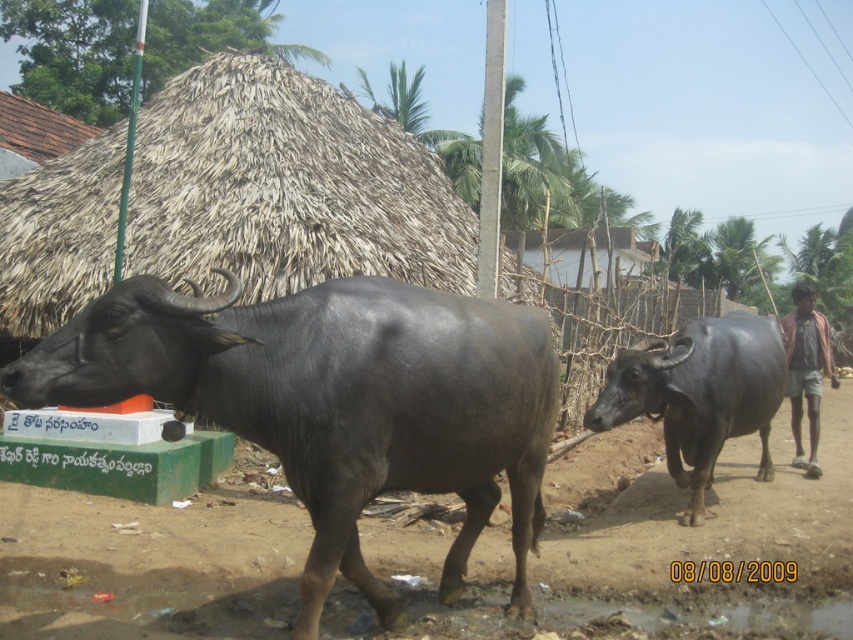
Question: Which object is farther from the camera taking this photo?

Choices:
 (A) black glossy bull at left
 (B) brown cotton shirt at right
 (C) shiny black bull at center

Answer: (B)

Question: Which of the following is the closest to the observer?

Choices:
 (A) black glossy bull at left
 (B) brown cotton shirt at right

Answer: (A)

Question: Does black glossy bull at left appear over brown cotton shirt at right?

Choices:
 (A) yes
 (B) no

Answer: (B)

Question: Is black glossy bull at left thinner than shiny black bull at center?

Choices:
 (A) no
 (B) yes

Answer: (A)

Question: Does black glossy bull at left have a greater width compared to shiny black bull at center?

Choices:
 (A) yes
 (B) no

Answer: (A)

Question: Among these objects, which one is nearest to the camera?

Choices:
 (A) brown cotton shirt at right
 (B) black glossy bull at left
 (C) shiny black bull at center

Answer: (B)